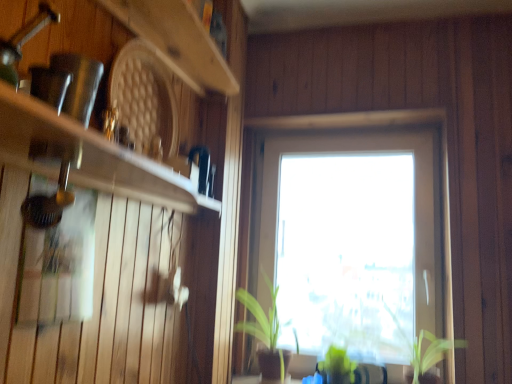
Identify the location of blank space situated above transparent glass window at center (from a real-world perspective). (358, 133).